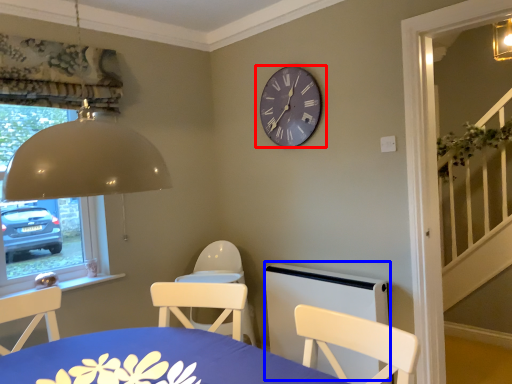
Question: Which of the following is the farthest to the observer, wall clock (highlighted by a red box) or bed frame (highlighted by a blue box)?

Choices:
 (A) wall clock
 (B) bed frame

Answer: (A)